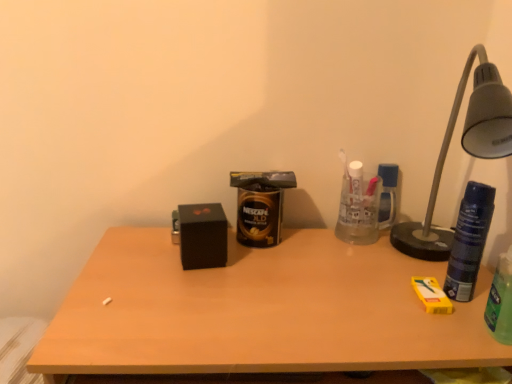
You are a GUI agent. You are given a task and a screenshot of the screen. Output one action in this format:
    pyautogui.click(x=<x>, y=<y>)
    Task: Click on the vacant space that is to the left of black matte box at center
    This screenshot has height=384, width=512.
    Given the screenshot: What is the action you would take?
    pyautogui.click(x=138, y=256)